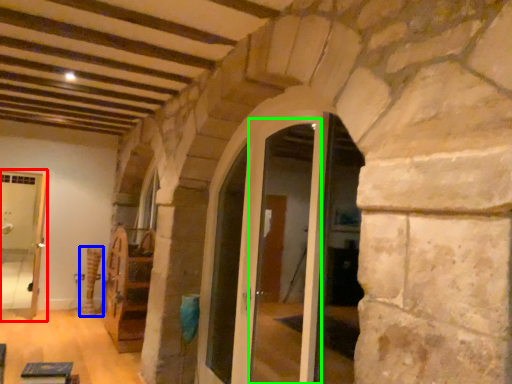
Question: Which object is the farthest from passage (highlighted by a red box)? Choose among these: pillar (highlighted by a blue box) or glass door (highlighted by a green box).

Choices:
 (A) pillar
 (B) glass door

Answer: (B)